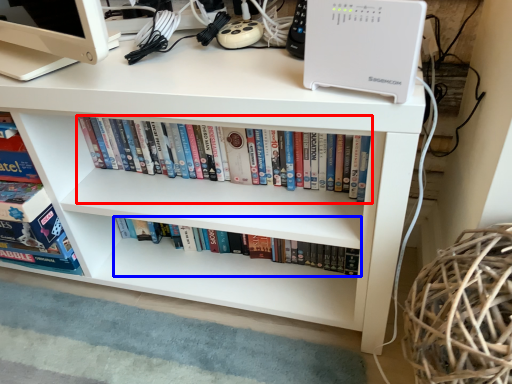
Question: Which object appears farthest to the camera in this image, book (highlighted by a red box) or book (highlighted by a blue box)?

Choices:
 (A) book
 (B) book

Answer: (B)